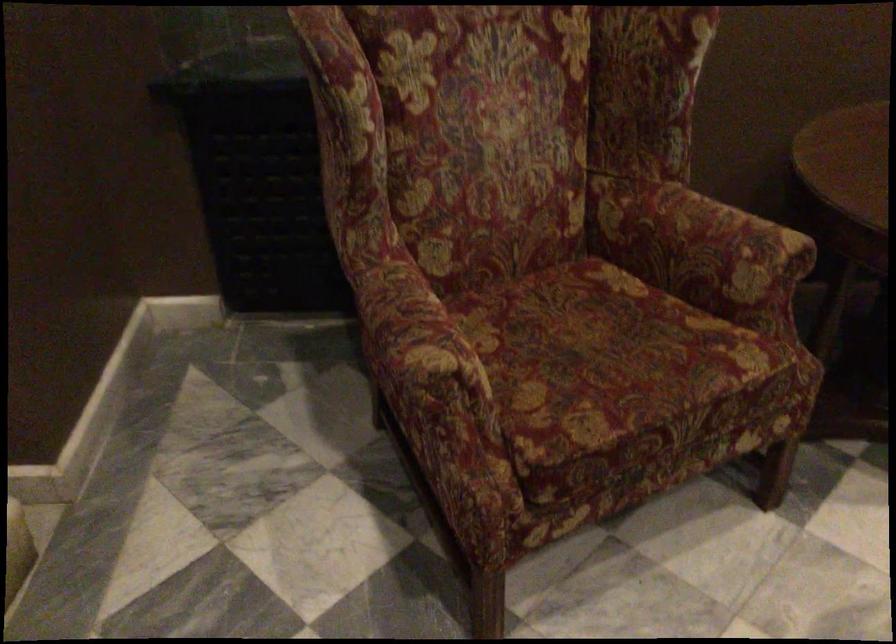
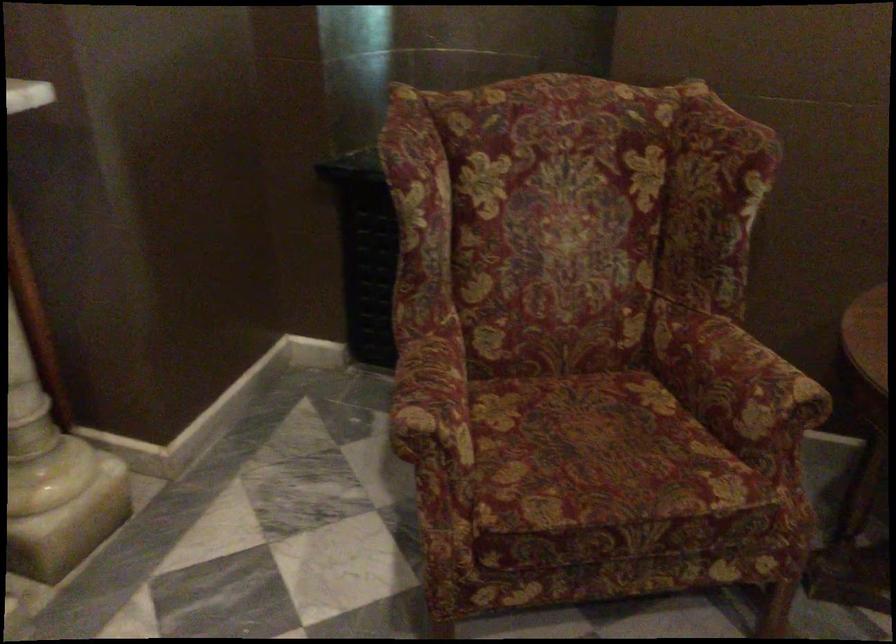
Question: How did the camera likely rotate?

Choices:
 (A) Left
 (B) Right
 (C) Up
 (D) Down

Answer: (A)